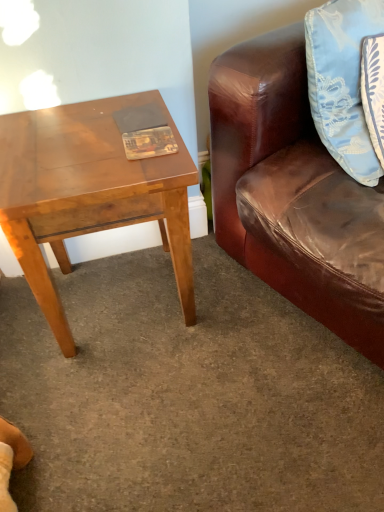
Find the location of a particular element. Image resolution: width=384 pixels, height=512 pixels. free space on the front side of light brown wooden table at left is located at coordinates (143, 407).